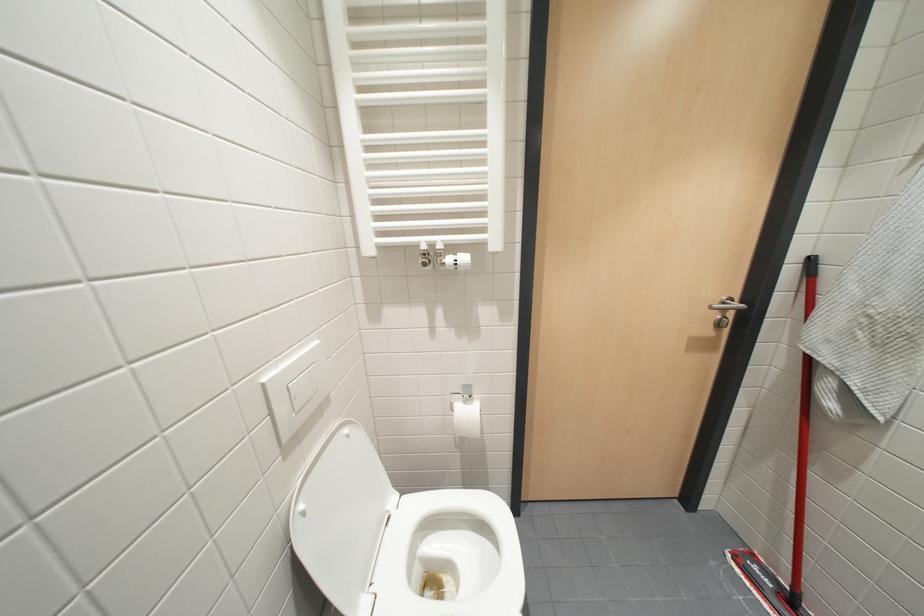
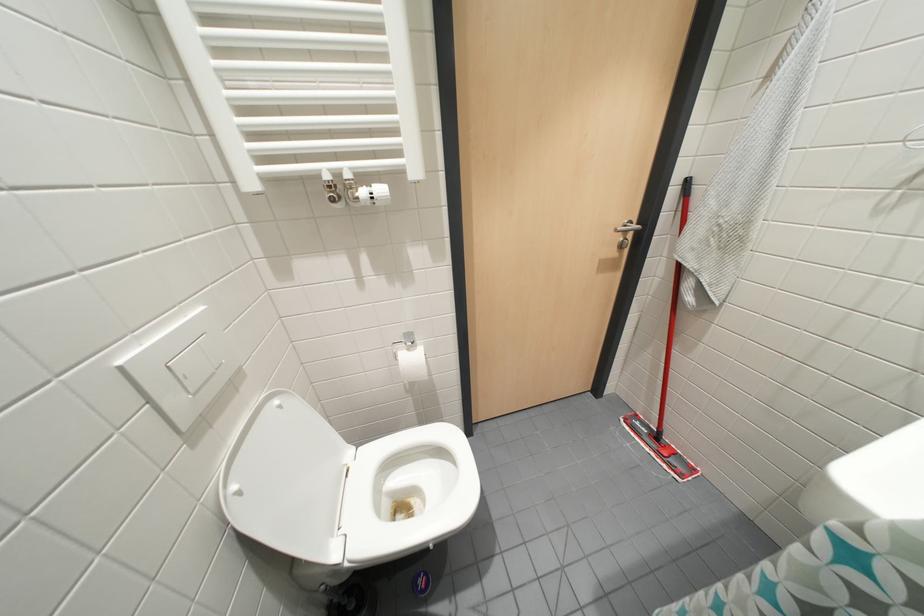
Which direction would the cameraman need to move to produce the second image?

The cameraman walked toward right, forward.